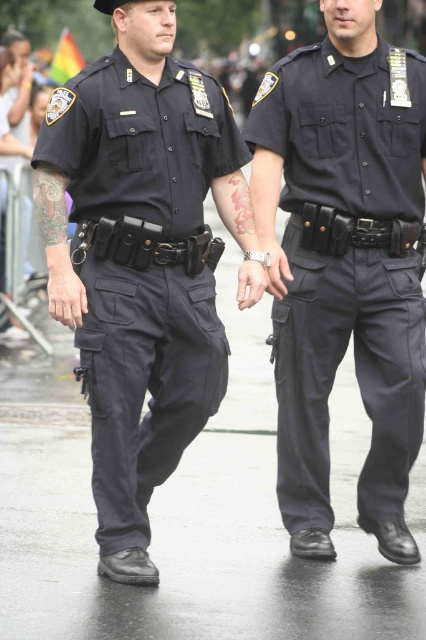
Question: Which point is farther from the camera taking this photo?

Choices:
 (A) (106, 504)
 (B) (304, 170)

Answer: (B)

Question: Considering the relative positions of matte black uniform at center and matte black uniform at left in the image provided, where is matte black uniform at center located with respect to matte black uniform at left?

Choices:
 (A) below
 (B) above

Answer: (B)

Question: Is matte black uniform at center positioned behind matte black uniform at left?

Choices:
 (A) yes
 (B) no

Answer: (A)

Question: Which point is farther to the camera?

Choices:
 (A) matte black uniform at left
 (B) matte black uniform at center

Answer: (B)

Question: Is the position of matte black uniform at center more distant than that of matte black uniform at left?

Choices:
 (A) no
 (B) yes

Answer: (B)